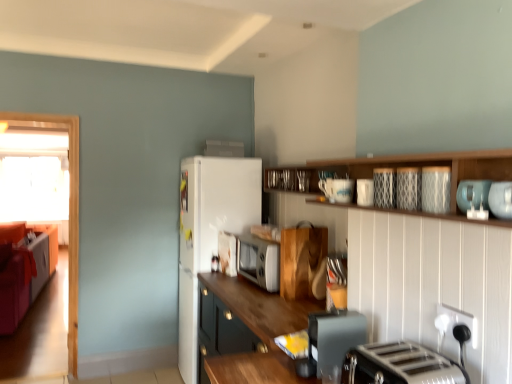
This screenshot has height=384, width=512. I want to click on vacant area to the left of white glossy microwave at center, which appears as the 2th appliance when viewed from the back, so click(210, 271).